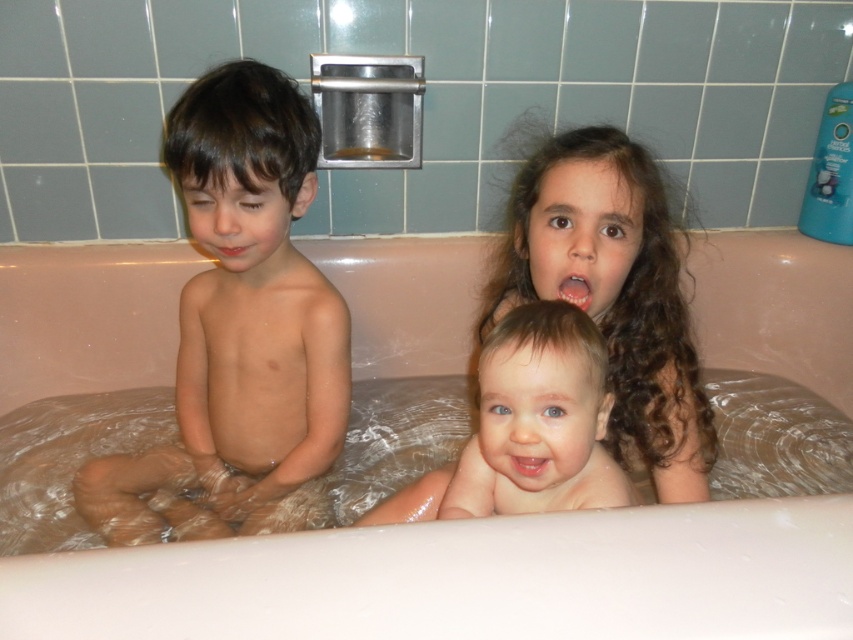
You are a parent trying to ensure all children in the bathtub are within a safe distance from the edge. The safe zone is defined as any position with an x coordinate between 0.4 and 0.6. Is the smooth skin boy at left within the safe zone?

The smooth skin boy at left is at position point 0.508, which falls within the x coordinate range of 0.4 to 0.6, so he is within the safe zone.

You are a parent trying to locate your child in the bathroom. You see the pink rubber bathtub at center and the pink glossy lips at upper center. Which object is higher up in the image?

The pink rubber bathtub at center is taller than pink glossy lips at upper center, so the bathtub is higher up in the image.

You are a parent trying to locate your child in the bathroom. You see the pink rubber bathtub at center and the pink glossy lips at upper center. Which object is closer to you?

The pink rubber bathtub at center is closer to you than the pink glossy lips at upper center.